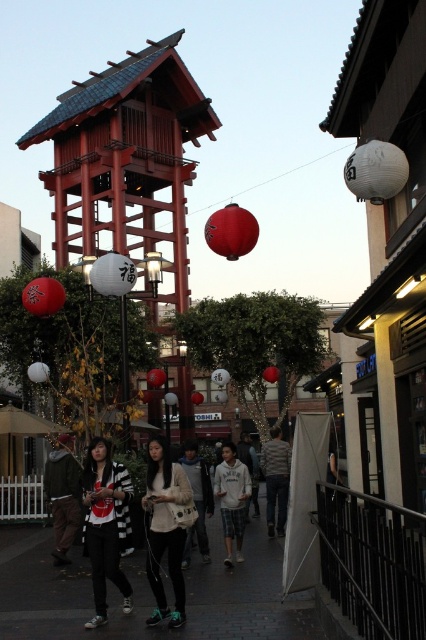
You are standing at the center of the street in the image. There is a point marked at coordinates (63,496). What object is located at this point?

The point at (63,496) corresponds to the green fuzzy jacket at lower left.

You are a photographer trying to capture both the matte black jacket at center and the white cotton hoodie at center in a single frame. Which of the two clothing items appears smaller in the photo?

The matte black jacket at center appears smaller in the photo compared to the white cotton hoodie at center.